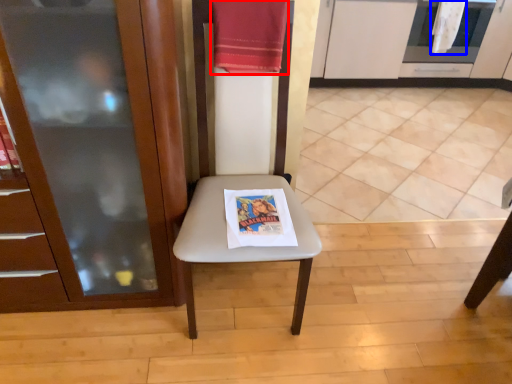
Question: Among these objects, which one is farthest to the camera, beach towel (highlighted by a red box) or beach towel (highlighted by a blue box)?

Choices:
 (A) beach towel
 (B) beach towel

Answer: (B)